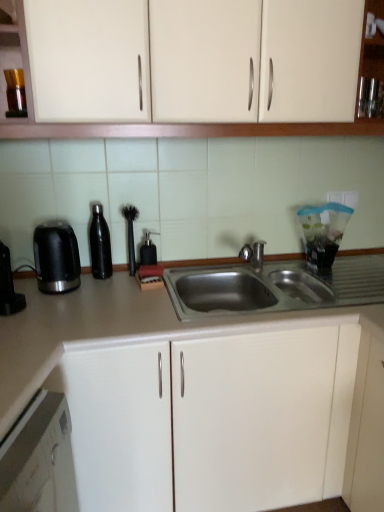
The width and height of the screenshot is (384, 512). What are the coordinates of `vacant space in front of clear plastic blender at right, the 3th appliance from the left` in the screenshot? It's located at (346, 281).